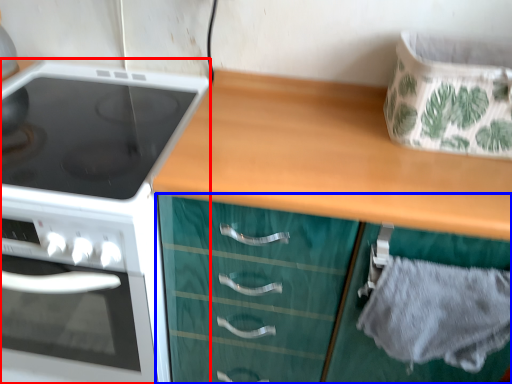
Question: Which object is further to the camera taking this photo, kitchen appliance (highlighted by a red box) or cabinetry (highlighted by a blue box)?

Choices:
 (A) kitchen appliance
 (B) cabinetry

Answer: (A)